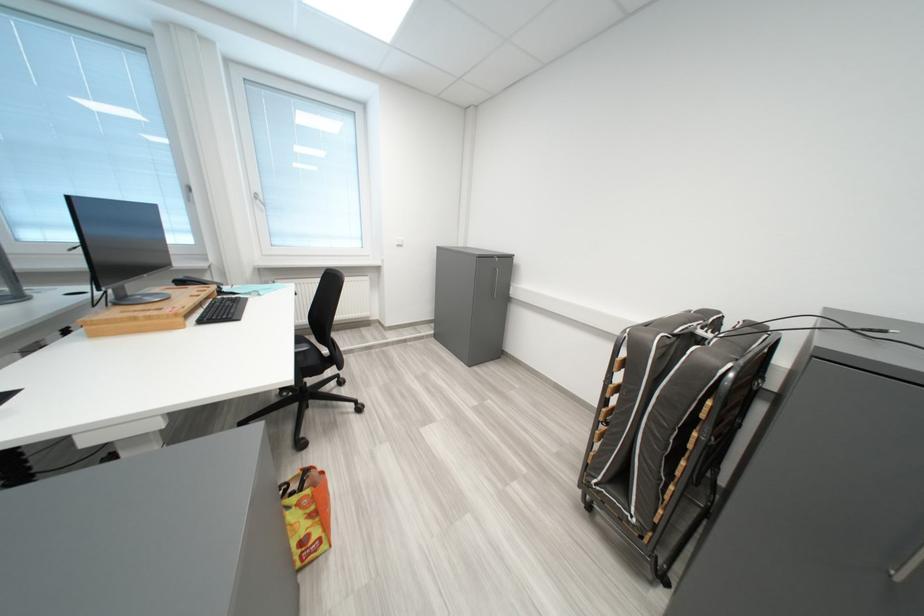
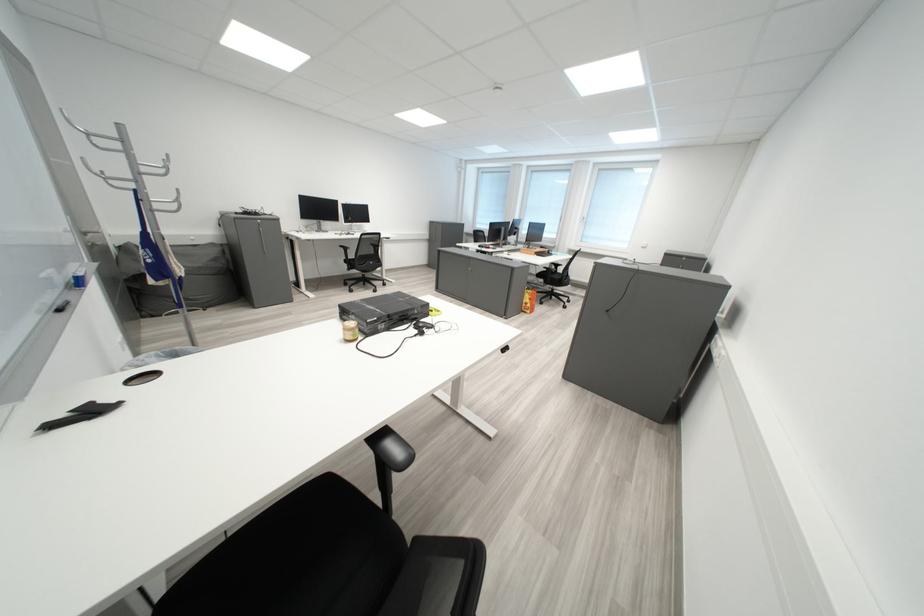
Locate, in the second image, the point that corresponds to pixel 321 381 in the first image.

(567, 290)